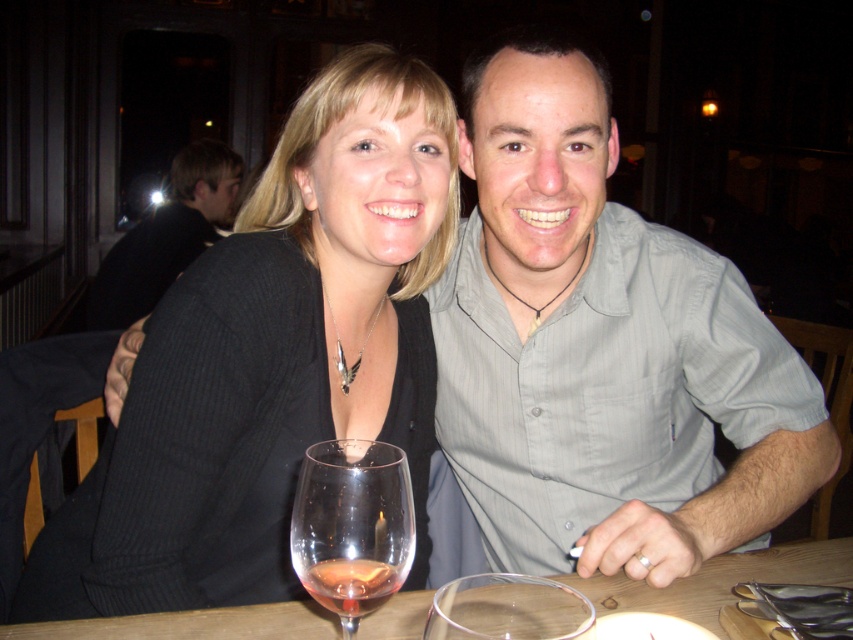
Question: Observing the image, what is the correct spatial positioning of wooden table at center in reference to dark gray shirt at upper left?

Choices:
 (A) right
 (B) left

Answer: (A)

Question: Which object is the farthest from the black sweater at center?

Choices:
 (A) transparent glass wine glass at center
 (B) translucent glass wine at center
 (C) dark gray shirt at upper left
 (D) wooden table at center

Answer: (C)

Question: Among these points, which one is nearest to the camera?

Choices:
 (A) (497, 627)
 (B) (247, 600)

Answer: (A)

Question: Can you confirm if wooden table at center is positioned above clear glass wine glass at center?

Choices:
 (A) yes
 (B) no

Answer: (B)

Question: Which point is farther from the camera taking this photo?

Choices:
 (A) (157, 256)
 (B) (463, 600)

Answer: (A)

Question: Does black sweater at center appear on the left side of wooden table at center?

Choices:
 (A) no
 (B) yes

Answer: (B)